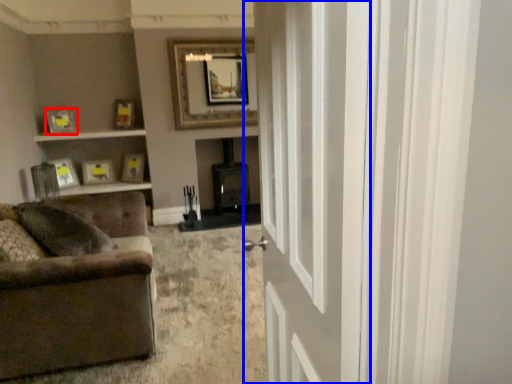
Question: Which object appears farthest to the camera in this image, picture frame (highlighted by a red box) or door (highlighted by a blue box)?

Choices:
 (A) picture frame
 (B) door

Answer: (A)